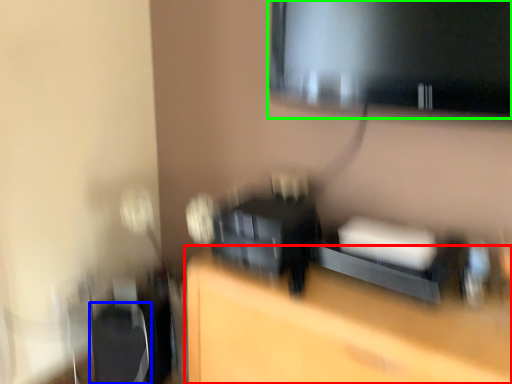
Question: Which object is positioned farthest from furniture (highlighted by a red box)? Select from swivel chair (highlighted by a blue box) and computer monitor (highlighted by a green box).

Choices:
 (A) swivel chair
 (B) computer monitor

Answer: (B)